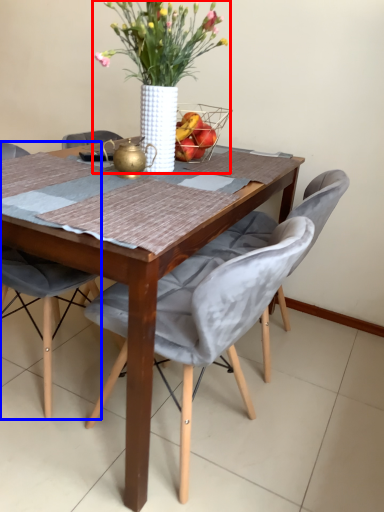
Question: Among these objects, which one is nearest to the camera, houseplant (highlighted by a red box) or chair (highlighted by a blue box)?

Choices:
 (A) houseplant
 (B) chair

Answer: (A)